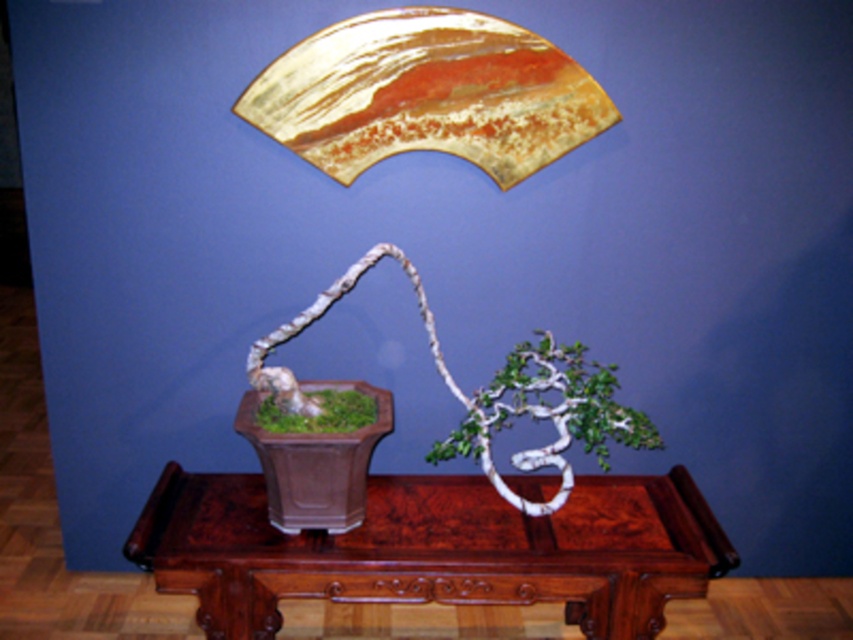
Is brown polished wood table at center positioned in front of green matte bonsai at center?

Yes.

Can you confirm if brown polished wood table at center is positioned above green matte bonsai at center?

No.

Where is `brown polished wood table at center`? This screenshot has width=853, height=640. brown polished wood table at center is located at coordinates (434, 548).